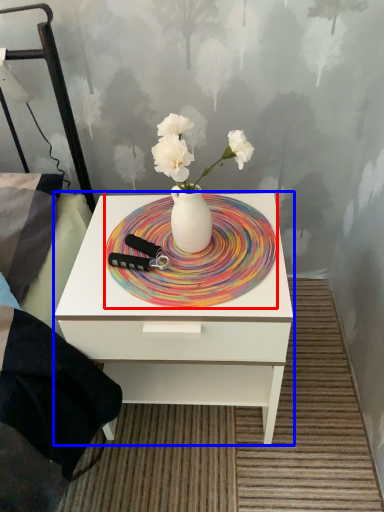
Question: Which object is closer to the camera taking this photo, plate (highlighted by a red box) or nightstand (highlighted by a blue box)?

Choices:
 (A) plate
 (B) nightstand

Answer: (B)